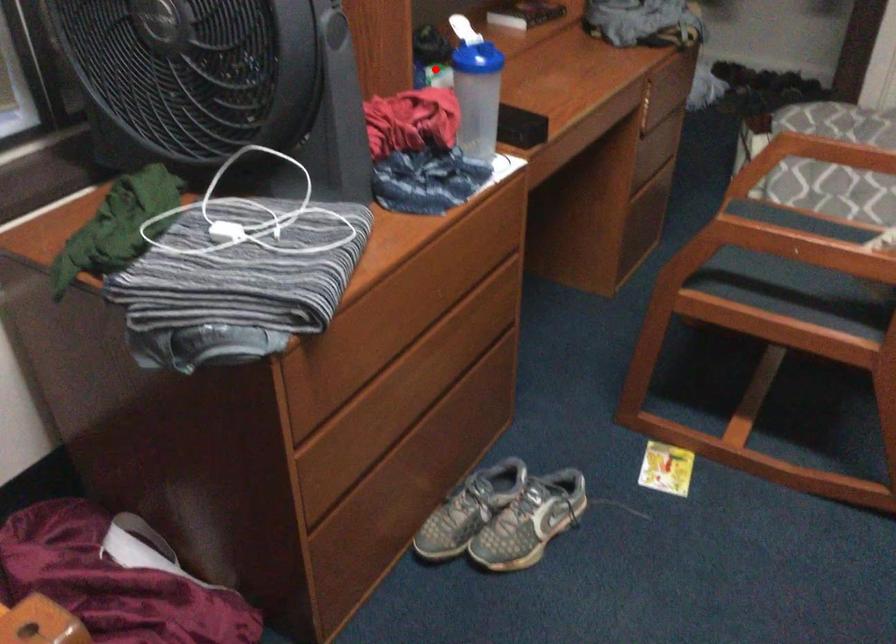
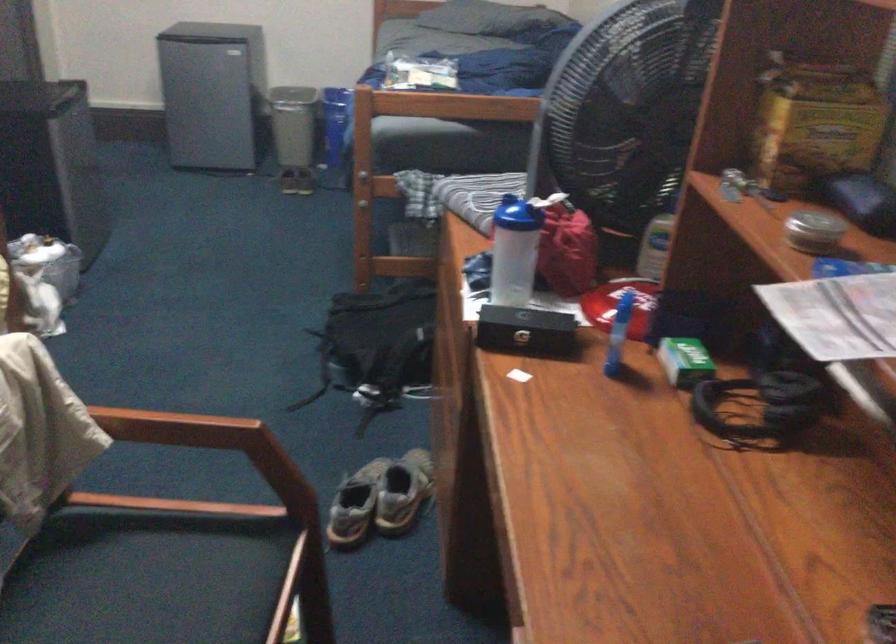
Question: I am providing you with two images of the same scene from different viewpoints. Image1 has a red point marked. In image2, the corresponding 3D location appears at what relative position? Reply with the corresponding letter.

Choices:
 (A) Closer
 (B) Farther

Answer: (A)